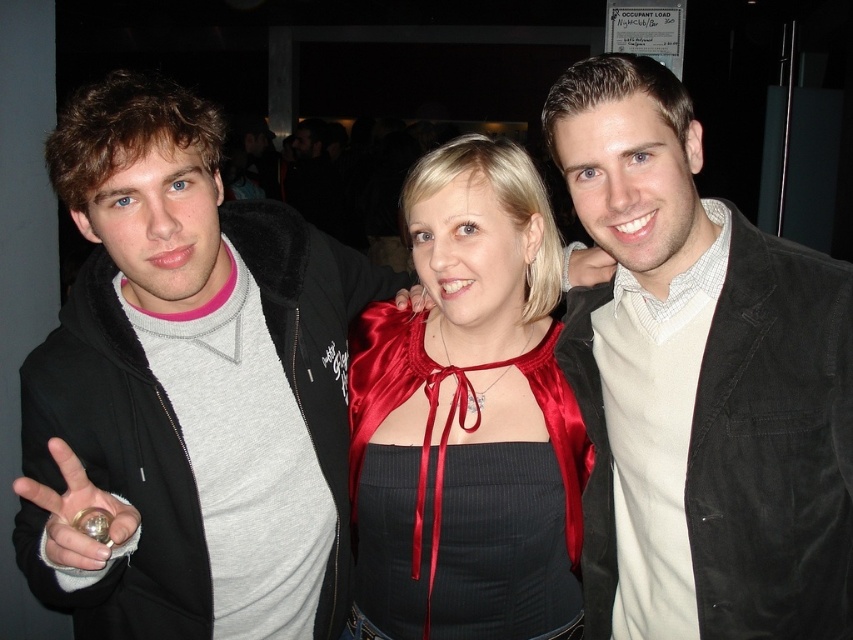
Question: Does matte black jacket at left come in front of suede jacket at center?

Choices:
 (A) yes
 (B) no

Answer: (A)

Question: Can you confirm if matte black jacket at left is bigger than satin cape at center?

Choices:
 (A) yes
 (B) no

Answer: (A)

Question: Which object is farther from the camera taking this photo?

Choices:
 (A) satin cape at center
 (B) suede jacket at center
 (C) matte black jacket at left

Answer: (A)

Question: Which point is farther to the camera?

Choices:
 (A) satin cape at center
 (B) matte black jacket at left
 (C) suede jacket at center

Answer: (A)

Question: Does matte black jacket at left appear over satin cape at center?

Choices:
 (A) yes
 (B) no

Answer: (A)

Question: Which point appears closest to the camera in this image?

Choices:
 (A) [689, 564]
 (B) [334, 513]
 (C) [480, 266]

Answer: (C)